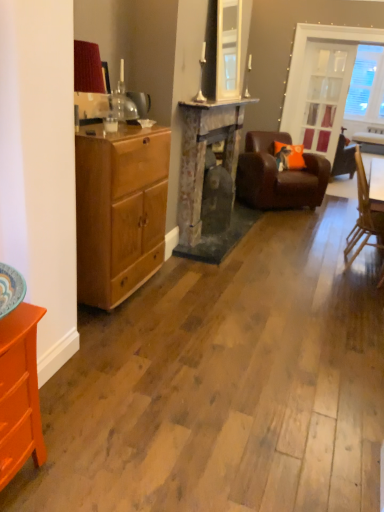
Where is `light brown wood cabinet at left`? The height and width of the screenshot is (512, 384). light brown wood cabinet at left is located at coordinates (119, 211).

Identify the location of orange fabric pillow at center. The image size is (384, 512). (289, 156).

Describe the element at coordinates (289, 156) in the screenshot. I see `orange fabric pillow at center` at that location.

Locate an element on the screen. brown leather armchair at center, arranged as the first chair when viewed from the back is located at coordinates (278, 175).

Identify the location of wooden chair at right, the first chair from the front. (364, 216).

Image resolution: width=384 pixels, height=512 pixels. Describe the element at coordinates (321, 83) in the screenshot. I see `clear glass door at upper right` at that location.

The height and width of the screenshot is (512, 384). What are the coordinates of `rustic stone fireplace at center` in the screenshot? It's located at (204, 155).

Is rustic stone fireplace at center spatially inside orange fabric pillow at center, or outside of it?

rustic stone fireplace at center is not enclosed by orange fabric pillow at center.

From the picture: Which object is closer to the camera taking this photo, rustic stone fireplace at center or orange fabric pillow at center?

rustic stone fireplace at center.

From a real-world perspective, which is physically above, rustic stone fireplace at center or orange fabric pillow at center?

From a 3D spatial view, rustic stone fireplace at center is above.

In terms of width, does rustic stone fireplace at center look wider or thinner when compared to wooden chair at right, arranged as the 2th chair when viewed from the back?

In the image, rustic stone fireplace at center appears to be more narrow than wooden chair at right, arranged as the 2th chair when viewed from the back.

Considering the sizes of objects rustic stone fireplace at center and wooden chair at right, arranged as the 2th chair when viewed from the back, in the image provided, who is shorter, rustic stone fireplace at center or wooden chair at right, arranged as the 2th chair when viewed from the back,?

wooden chair at right, arranged as the 2th chair when viewed from the back.

In the scene shown: Visually, is rustic stone fireplace at center positioned to the left or to the right of wooden chair at right, the first chair from the front?

rustic stone fireplace at center is to the left of wooden chair at right, the first chair from the front.

From a real-world perspective, is brown leather armchair at center, the 2th chair viewed from the front, physically located above or below clear glass door at upper right?

From a real-world perspective, brown leather armchair at center, the 2th chair viewed from the front, is physically below clear glass door at upper right.

Is brown leather armchair at center, arranged as the first chair when viewed from the back, outside of clear glass door at upper right?

Yes, brown leather armchair at center, arranged as the first chair when viewed from the back, is outside of clear glass door at upper right.

Which of these two, brown leather armchair at center, arranged as the first chair when viewed from the back, or clear glass door at upper right, is smaller?

clear glass door at upper right.

Does orange painted wood dresser at lower left have a smaller size compared to light brown wood cabinet at left?

Yes, orange painted wood dresser at lower left is smaller than light brown wood cabinet at left.

Who is more distant, orange painted wood dresser at lower left or light brown wood cabinet at left?

light brown wood cabinet at left is more distant.

Find the location of `the chest of drawers located above the orange painted wood dresser at lower left (from a real-world perspective)`. the chest of drawers located above the orange painted wood dresser at lower left (from a real-world perspective) is located at coordinates (119, 211).

Between orange painted wood dresser at lower left and light brown wood cabinet at left, which one has less height?

orange painted wood dresser at lower left is shorter.

Considering the positions of objects clear glass door at upper right and wooden chair at right, the first chair from the front, in the image provided, who is more to the right, clear glass door at upper right or wooden chair at right, the first chair from the front,?

Positioned to the right is clear glass door at upper right.

Does clear glass door at upper right lie in front of wooden chair at right, the first chair from the front?

No, clear glass door at upper right is further to the viewer.

Is point (288, 99) closer to viewer compared to point (372, 212)?

That is False.

From the image's perspective, is clear glass door at upper right on wooden chair at right, arranged as the 2th chair when viewed from the back?

Yes, from the image's perspective, clear glass door at upper right is above wooden chair at right, arranged as the 2th chair when viewed from the back.

Is rustic stone fireplace at center wider than clear glass door at upper right?

Correct, the width of rustic stone fireplace at center exceeds that of clear glass door at upper right.

Looking at this image, considering the relative sizes of rustic stone fireplace at center and clear glass door at upper right in the image provided, is rustic stone fireplace at center smaller than clear glass door at upper right?

Actually, rustic stone fireplace at center might be larger than clear glass door at upper right.

Does point (239, 111) appear closer or farther from the camera than point (319, 73)?

Point (239, 111).

Consider the image. Can you confirm if rustic stone fireplace at center is positioned to the right of clear glass door at upper right?

Incorrect, rustic stone fireplace at center is not on the right side of clear glass door at upper right.

Is clear glass door at upper right facing towards light brown wood cabinet at left?

Yes, clear glass door at upper right faces towards light brown wood cabinet at left.

From a real-world perspective, is clear glass door at upper right positioned under light brown wood cabinet at left based on gravity?

No.

Which of these two, clear glass door at upper right or light brown wood cabinet at left, stands taller?

Standing taller between the two is clear glass door at upper right.

How much distance is there between clear glass door at upper right and light brown wood cabinet at left?

clear glass door at upper right is 4.21 meters away from light brown wood cabinet at left.

Find the location of a particular element. This screenshot has width=384, height=512. pillow behind the rustic stone fireplace at center is located at coordinates (289, 156).

Locate an element on the screen. The image size is (384, 512). fireplace above the wooden chair at right, the first chair from the front (from a real-world perspective) is located at coordinates (204, 155).

When comparing their distances from wooden chair at right, arranged as the 2th chair when viewed from the back, does brown leather armchair at center, arranged as the first chair when viewed from the back, or light brown wood cabinet at left seem further?

light brown wood cabinet at left is positioned further to the anchor wooden chair at right, arranged as the 2th chair when viewed from the back.

Based on their spatial positions, is orange painted wood dresser at lower left or wooden chair at right, the first chair from the front, further from light brown wood cabinet at left?

wooden chair at right, the first chair from the front, is positioned further to the anchor light brown wood cabinet at left.

Based on their spatial positions, is orange fabric pillow at center or light brown wood cabinet at left further from rustic stone fireplace at center?

Among the two, orange fabric pillow at center is located further to rustic stone fireplace at center.

Considering their positions, is orange painted wood dresser at lower left positioned further to light brown wood cabinet at left than orange fabric pillow at center?

orange fabric pillow at center lies further to light brown wood cabinet at left than the other object.

Considering their positions, is light brown wood cabinet at left positioned closer to orange painted wood dresser at lower left than orange fabric pillow at center?

The object closer to orange painted wood dresser at lower left is light brown wood cabinet at left.

Looking at this image, which object lies further to the anchor point orange painted wood dresser at lower left, orange fabric pillow at center or light brown wood cabinet at left?

A: orange fabric pillow at center.

Based on their spatial positions, is light brown wood cabinet at left or brown leather armchair at center, the 2th chair viewed from the front, further from clear glass door at upper right?

Result: light brown wood cabinet at left lies further to clear glass door at upper right than the other object.

Looking at the image, which one is located further to rustic stone fireplace at center, orange fabric pillow at center or clear glass door at upper right?

Based on the image, clear glass door at upper right appears to be further to rustic stone fireplace at center.

I want to click on the chest of drawers located between orange painted wood dresser at lower left and brown leather armchair at center, the 2th chair viewed from the front, in the depth direction, so click(119, 211).

Locate an element on the screen. This screenshot has height=512, width=384. fireplace positioned between light brown wood cabinet at left and orange fabric pillow at center from near to far is located at coordinates (204, 155).

Find the location of a particular element. pillow between clear glass door at upper right and brown leather armchair at center, arranged as the first chair when viewed from the back, from top to bottom is located at coordinates (289, 156).

The width and height of the screenshot is (384, 512). In order to click on fireplace between light brown wood cabinet at left and clear glass door at upper right in the front-back direction in this screenshot , I will do `click(204, 155)`.